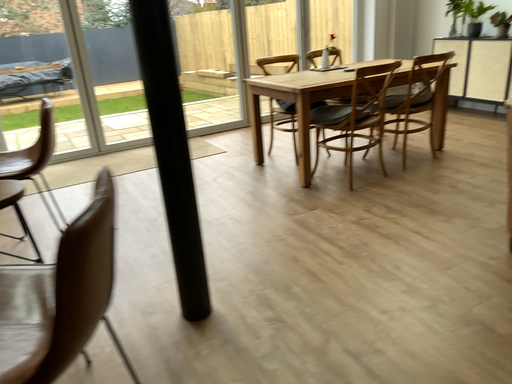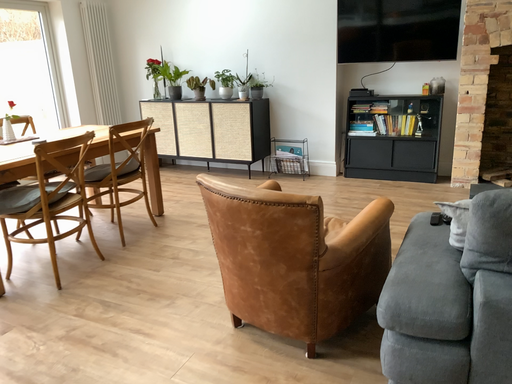
Question: How did the camera likely rotate when shooting the video?

Choices:
 (A) rotated upward
 (B) rotated downward

Answer: (A)